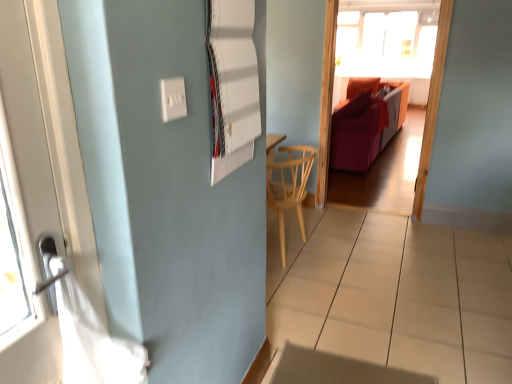
Question: Considering the relative sizes of velvet orange couch at center and transparent glass window at upper center in the image provided, is velvet orange couch at center bigger than transparent glass window at upper center?

Choices:
 (A) yes
 (B) no

Answer: (B)

Question: From a real-world perspective, is velvet orange couch at center on transparent glass window at upper center?

Choices:
 (A) no
 (B) yes

Answer: (A)

Question: Does velvet orange couch at center lie behind transparent glass window at upper center?

Choices:
 (A) yes
 (B) no

Answer: (B)

Question: Considering the relative positions of velvet orange couch at center and transparent glass window at upper center in the image provided, is velvet orange couch at center to the left of transparent glass window at upper center from the viewer's perspective?

Choices:
 (A) yes
 (B) no

Answer: (A)

Question: Considering the relative sizes of velvet orange couch at center and transparent glass window at upper center in the image provided, is velvet orange couch at center wider than transparent glass window at upper center?

Choices:
 (A) yes
 (B) no

Answer: (B)

Question: Is velvet orange couch at center facing towards transparent glass window at upper center?

Choices:
 (A) yes
 (B) no

Answer: (B)

Question: Would you say white plastic electric outlet at upper center contains transparent glass window at upper center?

Choices:
 (A) no
 (B) yes

Answer: (A)

Question: Is white plastic electric outlet at upper center positioned with its back to transparent glass window at upper center?

Choices:
 (A) yes
 (B) no

Answer: (B)

Question: Considering the relative sizes of white plastic electric outlet at upper center and transparent glass window at upper center in the image provided, is white plastic electric outlet at upper center taller than transparent glass window at upper center?

Choices:
 (A) no
 (B) yes

Answer: (A)

Question: Considering the relative positions of white plastic electric outlet at upper center and transparent glass window at upper center in the image provided, is white plastic electric outlet at upper center behind transparent glass window at upper center?

Choices:
 (A) no
 (B) yes

Answer: (A)

Question: From a real-world perspective, is white plastic electric outlet at upper center physically below transparent glass window at upper center?

Choices:
 (A) yes
 (B) no

Answer: (A)

Question: From the image's perspective, is white plastic electric outlet at upper center located beneath transparent glass window at upper center?

Choices:
 (A) no
 (B) yes

Answer: (B)

Question: Can white paperboard at upper center be found inside light wood chair at center?

Choices:
 (A) no
 (B) yes

Answer: (A)